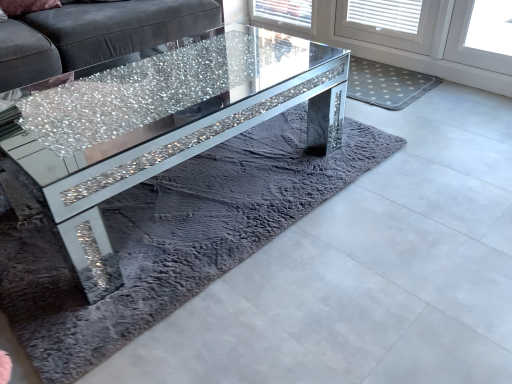
Question: Is sparkly glass table at center not near crystalline glass coffee table at center?

Choices:
 (A) yes
 (B) no

Answer: (B)

Question: From the image's perspective, is sparkly glass table at center located beneath crystalline glass coffee table at center?

Choices:
 (A) yes
 (B) no

Answer: (B)

Question: Could you tell me if sparkly glass table at center is facing crystalline glass coffee table at center?

Choices:
 (A) no
 (B) yes

Answer: (B)

Question: Is sparkly glass table at center further to the viewer compared to crystalline glass coffee table at center?

Choices:
 (A) no
 (B) yes

Answer: (B)

Question: Can you confirm if sparkly glass table at center is taller than crystalline glass coffee table at center?

Choices:
 (A) yes
 (B) no

Answer: (A)

Question: Considering the relative sizes of sparkly glass table at center and crystalline glass coffee table at center in the image provided, is sparkly glass table at center wider than crystalline glass coffee table at center?

Choices:
 (A) yes
 (B) no

Answer: (A)

Question: Does crystalline glass coffee table at center appear on the left side of sparkly glass table at center?

Choices:
 (A) yes
 (B) no

Answer: (B)

Question: Is crystalline glass coffee table at center further to the viewer compared to sparkly glass table at center?

Choices:
 (A) no
 (B) yes

Answer: (A)

Question: Is crystalline glass coffee table at center wider than sparkly glass table at center?

Choices:
 (A) yes
 (B) no

Answer: (B)

Question: Is sparkly glass table at center inside crystalline glass coffee table at center?

Choices:
 (A) no
 (B) yes

Answer: (A)

Question: From a real-world perspective, is crystalline glass coffee table at center under sparkly glass table at center?

Choices:
 (A) yes
 (B) no

Answer: (A)

Question: Is crystalline glass coffee table at center oriented away from sparkly glass table at center?

Choices:
 (A) yes
 (B) no

Answer: (A)

Question: Considering their positions, is crystalline glass coffee table at center located in front of or behind sparkly glass table at center?

Choices:
 (A) front
 (B) behind

Answer: (A)